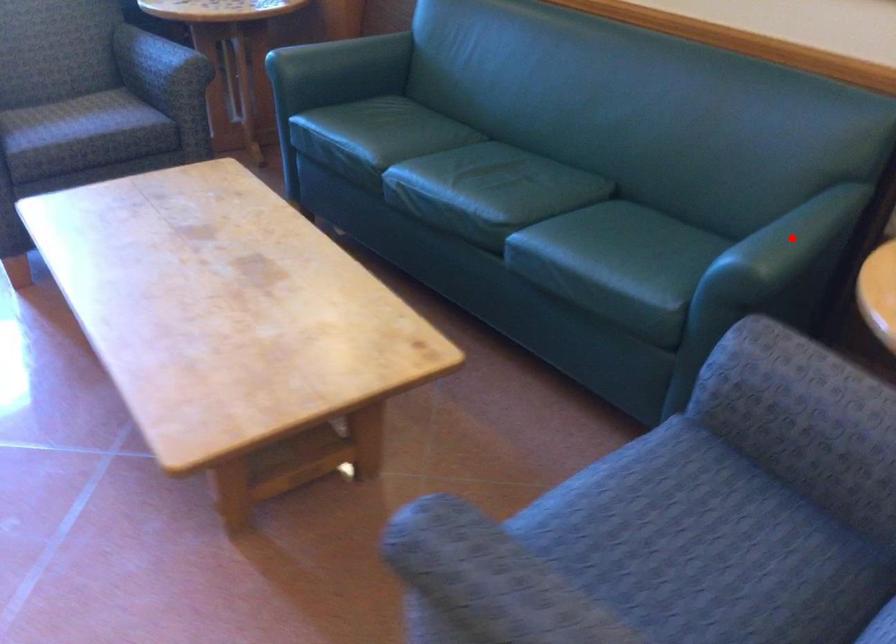
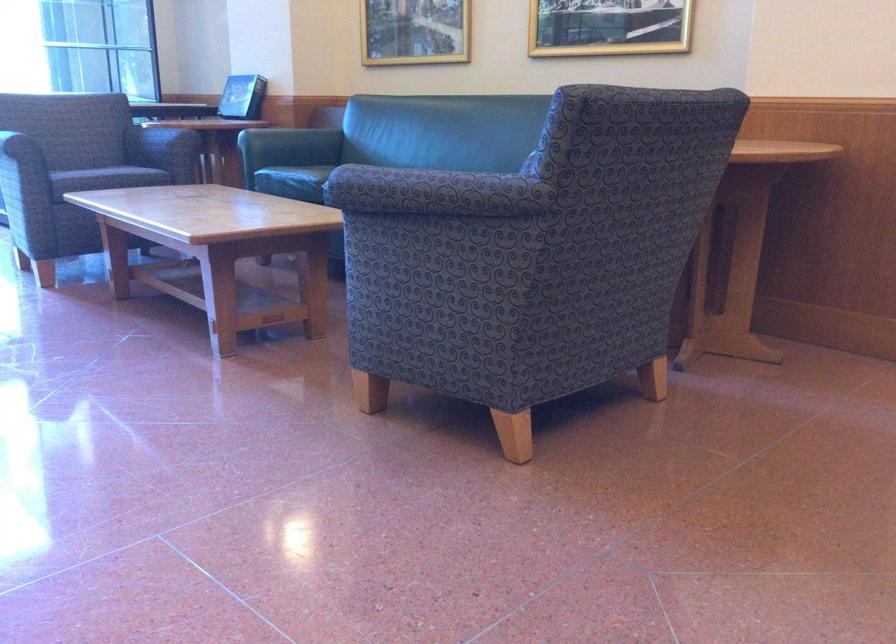
Question: I am providing you with two images of the same scene from different viewpoints. A red point is marked on the first image. Can you still see the location of the red point in image 2?

Choices:
 (A) Yes
 (B) No

Answer: (B)